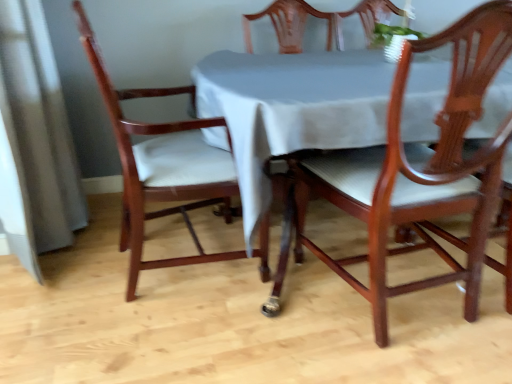
This screenshot has width=512, height=384. Identify the location of mahogany wood chair at left, which is the second chair in right-to-left order. (161, 166).

What do you see at coordinates (161, 166) in the screenshot? I see `mahogany wood chair at left, which is the second chair in right-to-left order` at bounding box center [161, 166].

Measure the distance between mahogany wood chair at center, the 2th chair when ordered from left to right, and camera.

mahogany wood chair at center, the 2th chair when ordered from left to right, and camera are 36.81 inches apart from each other.

Describe the element at coordinates (413, 172) in the screenshot. I see `mahogany wood chair at center, acting as the 1th chair starting from the right` at that location.

I want to click on mahogany wood chair at center, acting as the 1th chair starting from the right, so click(x=413, y=172).

Identify the location of mahogany wood chair at left, which is counted as the 1th chair, starting from the left. (161, 166).

Is mahogany wood chair at left, which is counted as the 1th chair, starting from the left, to the left of mahogany wood chair at center, acting as the 1th chair starting from the right, from the viewer's perspective?

Indeed, mahogany wood chair at left, which is counted as the 1th chair, starting from the left, is positioned on the left side of mahogany wood chair at center, acting as the 1th chair starting from the right.

Does mahogany wood chair at left, which is the second chair in right-to-left order, lie in front of mahogany wood chair at center, acting as the 1th chair starting from the right?

No, it is not.

Is point (200, 254) closer or farther from the camera than point (282, 241)?

Point (200, 254) is positioned closer to the camera compared to point (282, 241).

From the picture: From the image's perspective, which is above, mahogany wood chair at left, which is the second chair in right-to-left order, or mahogany wood chair at center, acting as the 1th chair starting from the right?

mahogany wood chair at left, which is the second chair in right-to-left order, from the image's perspective.

From a real-world perspective, which object rests below the other?

mahogany wood chair at left, which is counted as the 1th chair, starting from the left, from a real-world perspective.

Is mahogany wood chair at left, which is counted as the 1th chair, starting from the left, thinner than mahogany wood chair at center, the 2th chair when ordered from left to right?

Incorrect, the width of mahogany wood chair at left, which is counted as the 1th chair, starting from the left, is not less than that of mahogany wood chair at center, the 2th chair when ordered from left to right.

Considering the sizes of objects mahogany wood chair at left, which is the second chair in right-to-left order, and mahogany wood chair at center, acting as the 1th chair starting from the right, in the image provided, who is taller, mahogany wood chair at left, which is the second chair in right-to-left order, or mahogany wood chair at center, acting as the 1th chair starting from the right,?

mahogany wood chair at left, which is the second chair in right-to-left order.

Considering the sizes of mahogany wood chair at left, which is the second chair in right-to-left order, and mahogany wood chair at center, acting as the 1th chair starting from the right, in the image, is mahogany wood chair at left, which is the second chair in right-to-left order, bigger or smaller than mahogany wood chair at center, acting as the 1th chair starting from the right,?

In the image, mahogany wood chair at left, which is the second chair in right-to-left order, appears to be larger than mahogany wood chair at center, acting as the 1th chair starting from the right.

Is mahogany wood chair at left, which is counted as the 1th chair, starting from the left, not within mahogany wood chair at center, the 2th chair when ordered from left to right?

Indeed, mahogany wood chair at left, which is counted as the 1th chair, starting from the left, is completely outside mahogany wood chair at center, the 2th chair when ordered from left to right.

Consider the image. Is mahogany wood chair at left, which is counted as the 1th chair, starting from the left, positioned far away from mahogany wood chair at center, acting as the 1th chair starting from the right?

No, mahogany wood chair at left, which is counted as the 1th chair, starting from the left, is in close proximity to mahogany wood chair at center, acting as the 1th chair starting from the right.

Is mahogany wood chair at left, which is counted as the 1th chair, starting from the left, facing away from mahogany wood chair at center, the 2th chair when ordered from left to right?

No, mahogany wood chair at left, which is counted as the 1th chair, starting from the left, is not facing the opposite direction of mahogany wood chair at center, the 2th chair when ordered from left to right.

How many degrees apart are the facing directions of mahogany wood chair at left, which is the second chair in right-to-left order, and mahogany wood chair at center, the 2th chair when ordered from left to right?

There is a 90-degree angle between the facing directions of mahogany wood chair at left, which is the second chair in right-to-left order, and mahogany wood chair at center, the 2th chair when ordered from left to right.

How far apart are mahogany wood chair at left, which is the second chair in right-to-left order, and mahogany wood chair at center, the 2th chair when ordered from left to right?

mahogany wood chair at left, which is the second chair in right-to-left order, and mahogany wood chair at center, the 2th chair when ordered from left to right, are 19.38 inches apart.

Locate an element on the screen. chair behind the mahogany wood chair at center, the 2th chair when ordered from left to right is located at coordinates (161, 166).

Is mahogany wood chair at center, acting as the 1th chair starting from the right, at the left side of mahogany wood chair at left, which is counted as the 1th chair, starting from the left?

No, mahogany wood chair at center, acting as the 1th chair starting from the right, is not to the left of mahogany wood chair at left, which is counted as the 1th chair, starting from the left.

Considering their positions, is mahogany wood chair at center, the 2th chair when ordered from left to right, located in front of or behind mahogany wood chair at left, which is the second chair in right-to-left order?

In the image, mahogany wood chair at center, the 2th chair when ordered from left to right, appears in front of mahogany wood chair at left, which is the second chair in right-to-left order.

Does point (407, 179) lie behind point (269, 278)?

No, (407, 179) is in front of (269, 278).

Looking at this image, from the image's perspective, is mahogany wood chair at center, acting as the 1th chair starting from the right, located above or below mahogany wood chair at left, which is counted as the 1th chair, starting from the left?

Based on their image positions, mahogany wood chair at center, acting as the 1th chair starting from the right, is located beneath mahogany wood chair at left, which is counted as the 1th chair, starting from the left.

From a real-world perspective, is mahogany wood chair at center, the 2th chair when ordered from left to right, physically below mahogany wood chair at left, which is counted as the 1th chair, starting from the left?

No.

Which of these two, mahogany wood chair at center, the 2th chair when ordered from left to right, or mahogany wood chair at left, which is counted as the 1th chair, starting from the left, is thinner?

Thinner between the two is mahogany wood chair at center, the 2th chair when ordered from left to right.

Considering the relative sizes of mahogany wood chair at center, acting as the 1th chair starting from the right, and mahogany wood chair at left, which is the second chair in right-to-left order, in the image provided, is mahogany wood chair at center, acting as the 1th chair starting from the right, shorter than mahogany wood chair at left, which is the second chair in right-to-left order,?

Indeed, mahogany wood chair at center, acting as the 1th chair starting from the right, has a lesser height compared to mahogany wood chair at left, which is the second chair in right-to-left order.

Looking at the image, does mahogany wood chair at center, the 2th chair when ordered from left to right, seem bigger or smaller compared to mahogany wood chair at left, which is counted as the 1th chair, starting from the left?

Clearly, mahogany wood chair at center, the 2th chair when ordered from left to right, is smaller in size than mahogany wood chair at left, which is counted as the 1th chair, starting from the left.

Would you say mahogany wood chair at left, which is the second chair in right-to-left order, is part of mahogany wood chair at center, the 2th chair when ordered from left to right,'s contents?

That's incorrect, mahogany wood chair at left, which is the second chair in right-to-left order, is not inside mahogany wood chair at center, the 2th chair when ordered from left to right.

Are mahogany wood chair at center, acting as the 1th chair starting from the right, and mahogany wood chair at left, which is counted as the 1th chair, starting from the left, beside each other?

No, mahogany wood chair at center, acting as the 1th chair starting from the right, is not making contact with mahogany wood chair at left, which is counted as the 1th chair, starting from the left.

Is mahogany wood chair at center, acting as the 1th chair starting from the right, turned away from mahogany wood chair at left, which is the second chair in right-to-left order?

That's not correct — mahogany wood chair at center, acting as the 1th chair starting from the right, is not looking away from mahogany wood chair at left, which is the second chair in right-to-left order.

What's the angular difference between mahogany wood chair at center, acting as the 1th chair starting from the right, and mahogany wood chair at left, which is counted as the 1th chair, starting from the left,'s facing directions?

The angular difference between mahogany wood chair at center, acting as the 1th chair starting from the right, and mahogany wood chair at left, which is counted as the 1th chair, starting from the left, is 90 degrees.

Locate an element on the screen. chair to the right of mahogany wood chair at left, which is counted as the 1th chair, starting from the left is located at coordinates (413, 172).

You are a GUI agent. You are given a task and a screenshot of the screen. Output one action in this format:
    pyautogui.click(x=<x>, y=<y>)
    Task: Click on the chair on the left of mahogany wood chair at center, acting as the 1th chair starting from the right
    This screenshot has height=384, width=512.
    Given the screenshot: What is the action you would take?
    pyautogui.click(x=161, y=166)

At what (x,y) coordinates should I click in order to perform the action: click on chair on the right of mahogany wood chair at left, which is the second chair in right-to-left order. Please return your answer as a coordinate pair (x, y). Looking at the image, I should click on (x=413, y=172).